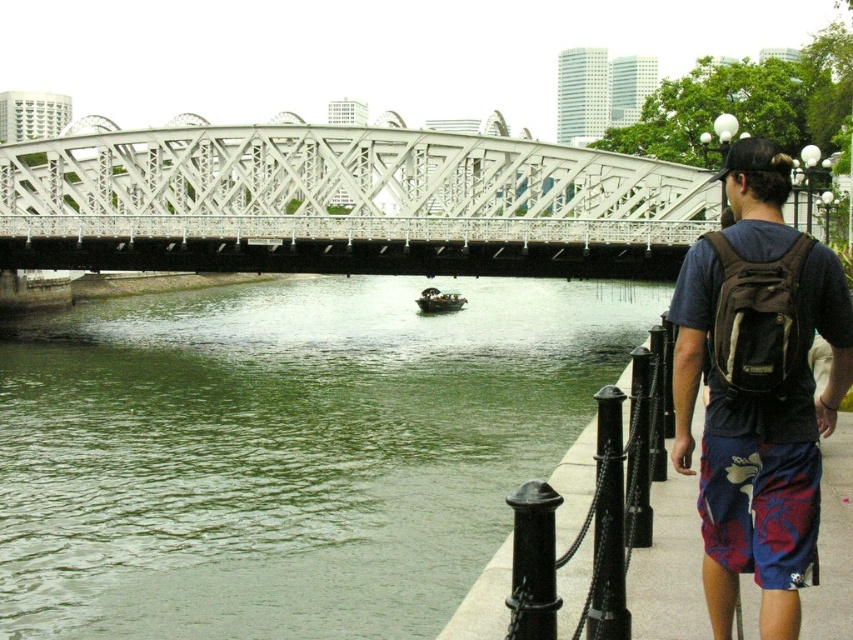
You are standing on the riverside pathway and see the green water at center and the floral print shorts at lower right. Which object is wider in the scene?

The green water at center might be wider than floral print shorts at lower right.

You are standing at the riverside and want to take a photo of the two points marked in the image. Which point is closer to your camera, point (x=316, y=561) or point (x=723, y=436)?

Point (x=723, y=436) is closer to the camera because it is less further than point (x=316, y=561).

You are standing at the point labeled as point (761,508) in the image. What object is located at this coordinate?

The point (761,508) corresponds to the floral print shorts at lower right.